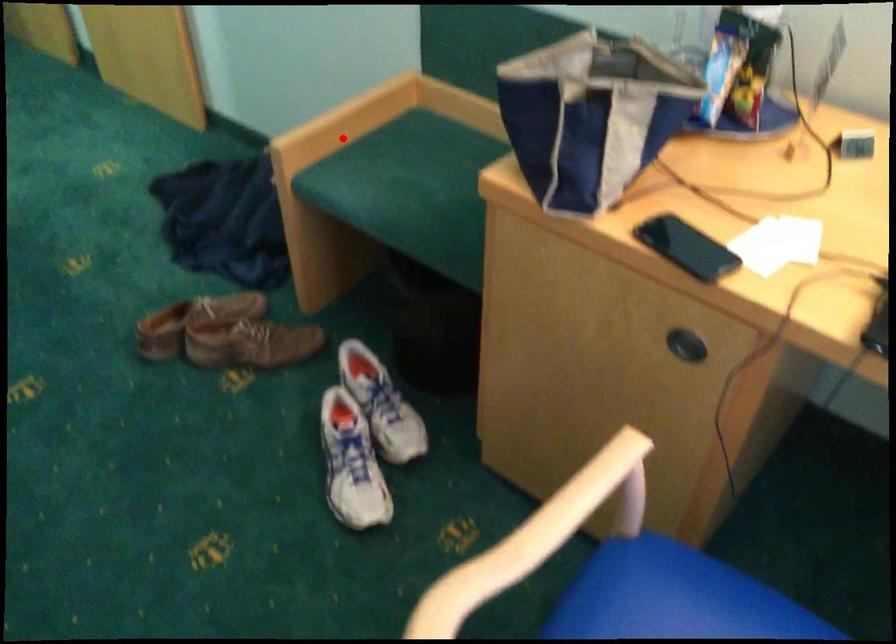
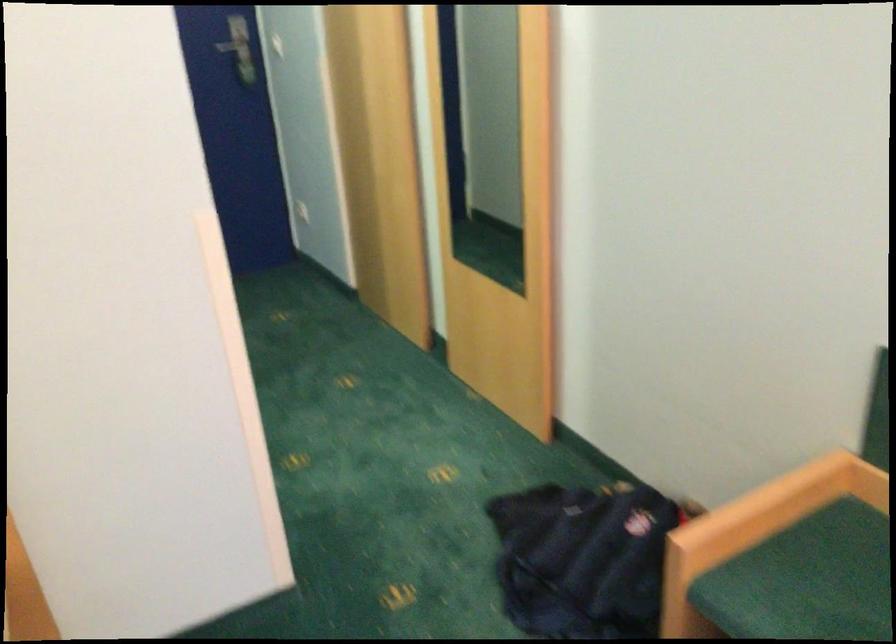
Question: A red point is marked in image1. In image2, is the corresponding 3D point closer to the camera or farther? Reply with the corresponding letter.

Choices:
 (A) The corresponding 3D point is closer.
 (B) The corresponding 3D point is farther.

Answer: (A)